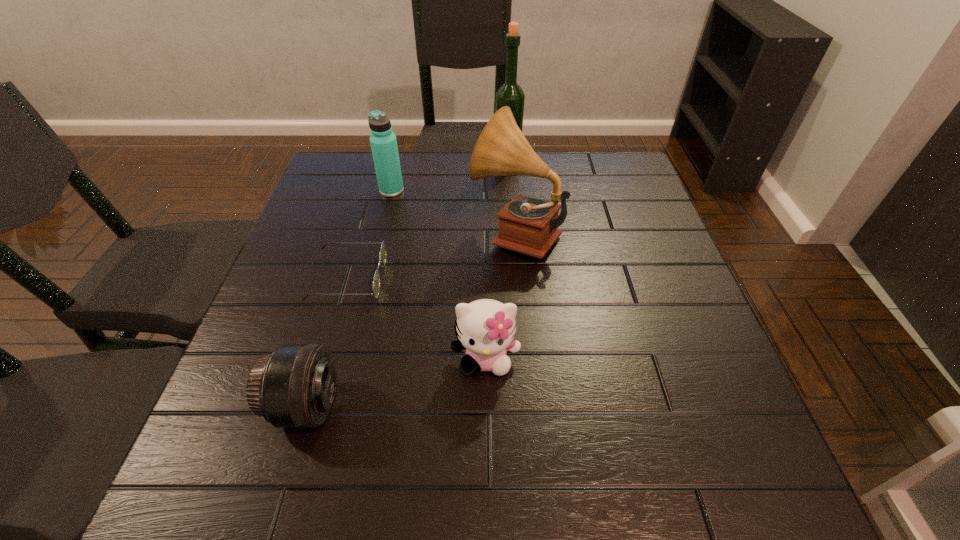
The height and width of the screenshot is (540, 960). I want to click on the tallest object, so click(510, 94).

Find the location of a particular element. liquor is located at coordinates (510, 94).

Find the location of a particular element. The image size is (960, 540). the second tallest object is located at coordinates (527, 225).

You are a GUI agent. You are given a task and a screenshot of the screen. Output one action in this format:
    pyautogui.click(x=<x>, y=<y>)
    Task: Click on the fourth shortest object
    
    Given the screenshot: What is the action you would take?
    pyautogui.click(x=383, y=141)

The image size is (960, 540). In order to click on the fifth nearest object in this screenshot , I will do `click(383, 141)`.

Identify the location of kitten. (485, 328).

At what (x,y) coordinates should I click in order to perform the action: click on telephoto lens. Please return your answer as a coordinate pair (x, y). The width and height of the screenshot is (960, 540). Looking at the image, I should click on (293, 387).

At what (x,y) coordinates should I click in order to perform the action: click on sunglasses. Please return your answer as a coordinate pair (x, y). Looking at the image, I should click on (382, 258).

Find the location of a particular element. The width and height of the screenshot is (960, 540). free space located 0.190m on the front of the tallest object is located at coordinates (511, 205).

Find the location of a particular element. This screenshot has height=540, width=960. vacant region located on the horn of the phonograph record is located at coordinates (426, 233).